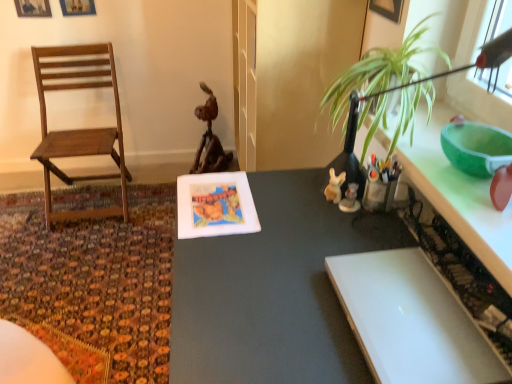
Where is `free point to the left of white glossy figurine at center-right, which is the second toy from left to right`? The image size is (512, 384). free point to the left of white glossy figurine at center-right, which is the second toy from left to right is located at coordinates (291, 210).